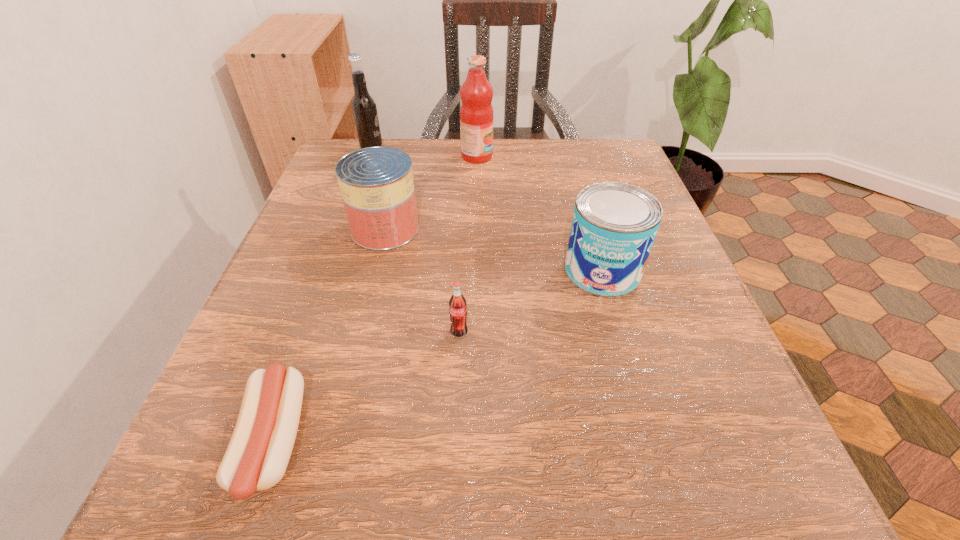
Find the location of a particular element. This screenshot has width=960, height=540. fruit juice is located at coordinates (476, 113).

You are a GUI agent. You are given a task and a screenshot of the screen. Output one action in this format:
    pyautogui.click(x=<x>, y=<y>)
    Task: Click on the root beer
    This screenshot has height=540, width=960.
    Given the screenshot: What is the action you would take?
    pyautogui.click(x=364, y=109)

You are a GUI agent. You are given a task and a screenshot of the screen. Output one action in this format:
    pyautogui.click(x=<x>, y=<y>)
    Task: Click on the left can
    
    Given the screenshot: What is the action you would take?
    pyautogui.click(x=376, y=183)

At what (x,y) coordinates should I click in order to perform the action: click on the right can. Please return your answer as a coordinate pair (x, y). The height and width of the screenshot is (540, 960). Looking at the image, I should click on (614, 225).

Identify the location of the fifth tallest object. This screenshot has width=960, height=540. (457, 304).

Identify the location of the fifth farthest object. (457, 304).

At what (x,y) coordinates should I click in order to perform the action: click on the shortest object. Please return your answer as a coordinate pair (x, y). The height and width of the screenshot is (540, 960). Looking at the image, I should click on (257, 456).

Where is `the nearest object`? the nearest object is located at coordinates (257, 456).

You are a GUI agent. You are given a task and a screenshot of the screen. Output one action in this format:
    pyautogui.click(x=<x>, y=<y>)
    Task: Click on the vacant region located on the front label of the fruit juice
    The height and width of the screenshot is (540, 960).
    Given the screenshot: What is the action you would take?
    pyautogui.click(x=521, y=157)

You are a GUI agent. You are given a task and a screenshot of the screen. Output one action in this format:
    pyautogui.click(x=<x>, y=<y>)
    Task: Click on the blank area located 0.320m on the label of the root beer
    
    Given the screenshot: What is the action you would take?
    pyautogui.click(x=514, y=151)